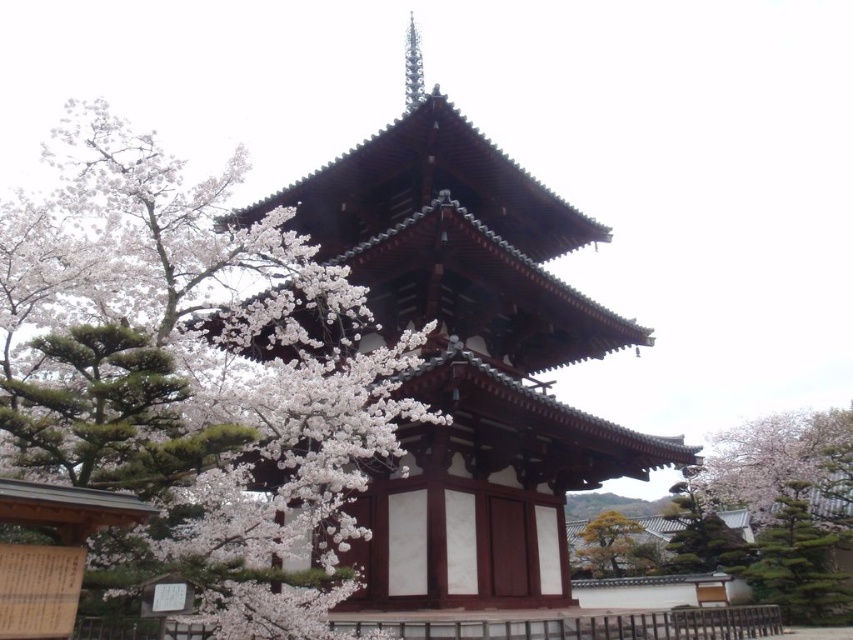
Question: Which point is closer to the camera taking this photo?

Choices:
 (A) (822, 548)
 (B) (722, 540)

Answer: (A)

Question: Does white blossoms at center appear under yellow-green leafy tree at lower right?

Choices:
 (A) yes
 (B) no

Answer: (B)

Question: Which point appears closest to the camera in this image?

Choices:
 (A) (634, 524)
 (B) (71, 198)
 (C) (842, 589)

Answer: (B)

Question: Is green textured pine tree at right bigger than green textured tree at lower right?

Choices:
 (A) no
 (B) yes

Answer: (B)

Question: Among these points, which one is nearest to the camera?

Choices:
 (A) (788, 612)
 (B) (183, 237)
 (C) (587, 545)

Answer: (B)

Question: Does green textured pine tree at right appear on the right side of green textured tree at lower right?

Choices:
 (A) no
 (B) yes

Answer: (B)